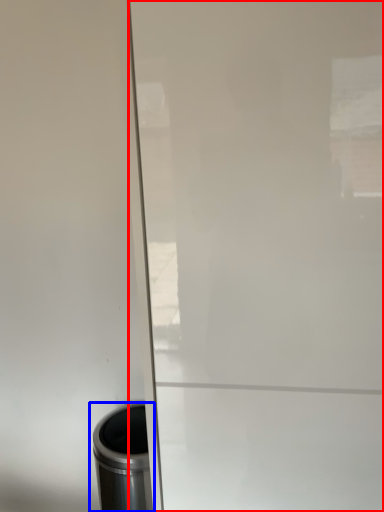
Question: Which point is closer to the camera, screen door (highlighted by a red box) or waste container (highlighted by a blue box)?

Choices:
 (A) screen door
 (B) waste container

Answer: (A)